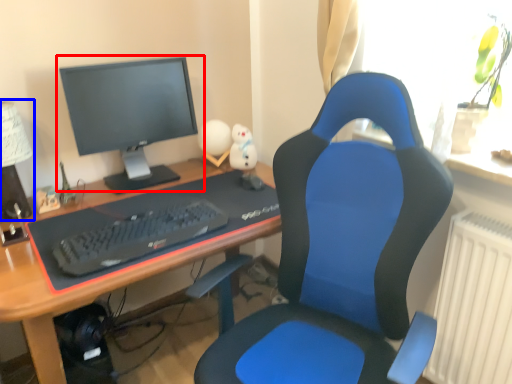
Question: Which object is closer to the camera taking this photo, computer monitor (highlighted by a red box) or table lamp (highlighted by a blue box)?

Choices:
 (A) computer monitor
 (B) table lamp

Answer: (B)